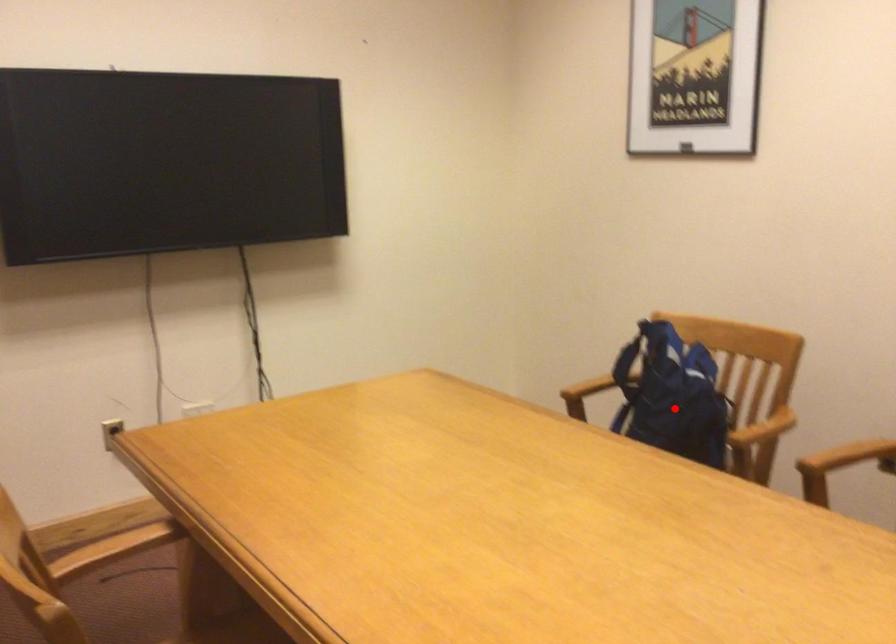
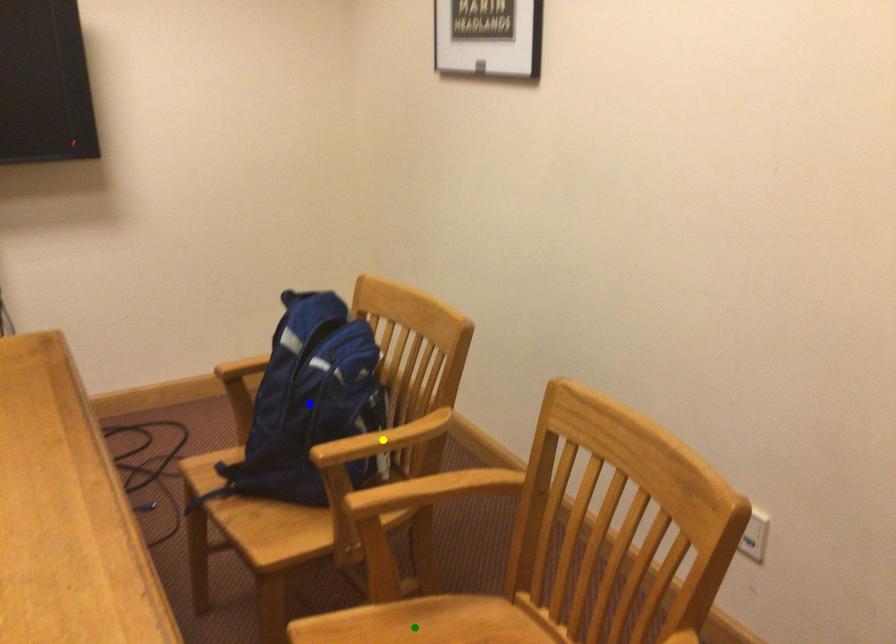
Question: I am providing you with two images of the same scene from different viewpoints. A red point is marked on the first image. You are given multiple points on the second image. Which spot in image 2 lines up with the point in image 1?

Choices:
 (A) blue point
 (B) yellow point
 (C) green point

Answer: (A)